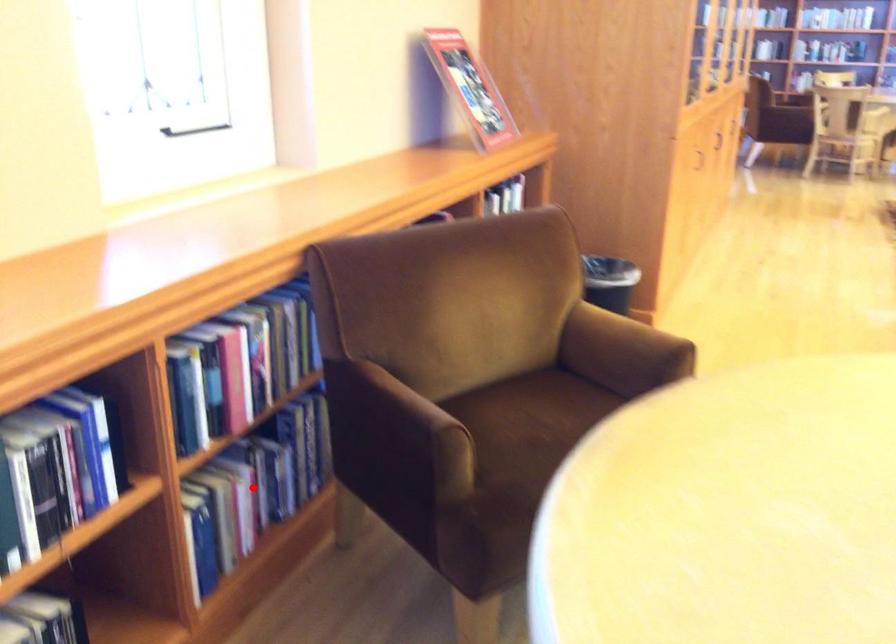
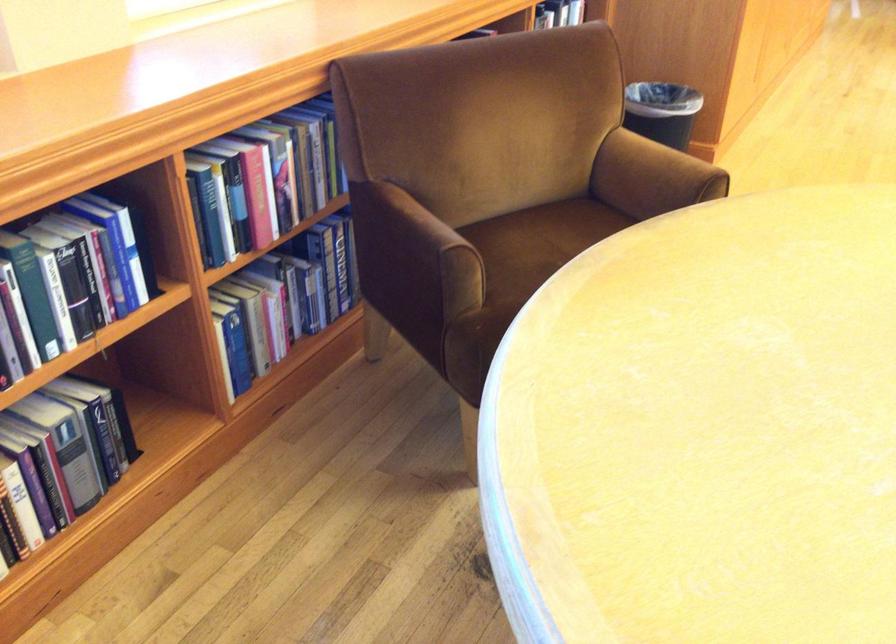
Find the pixel in the second image that matches the highlighted location in the first image.

(282, 299)